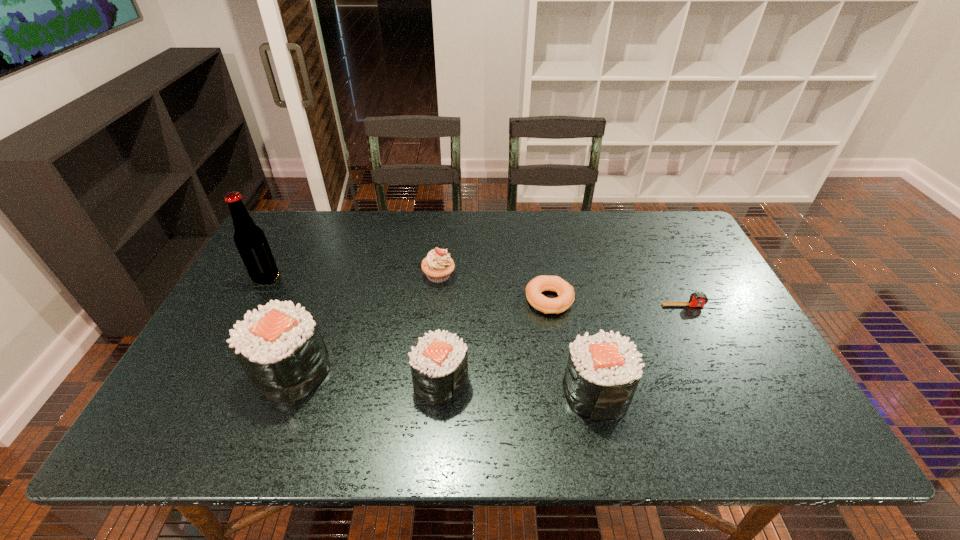
In order to click on vacant space that satisfies the following two spatial constraints: 1. on the front side of the shortest sushi; 2. on the right side of the tallest object in this screenshot , I will do `click(211, 381)`.

What are the coordinates of `free spot that satisfies the following two spatial constraints: 1. on the front side of the shortest sushi; 2. on the right side of the leftmost object` in the screenshot? It's located at (211, 381).